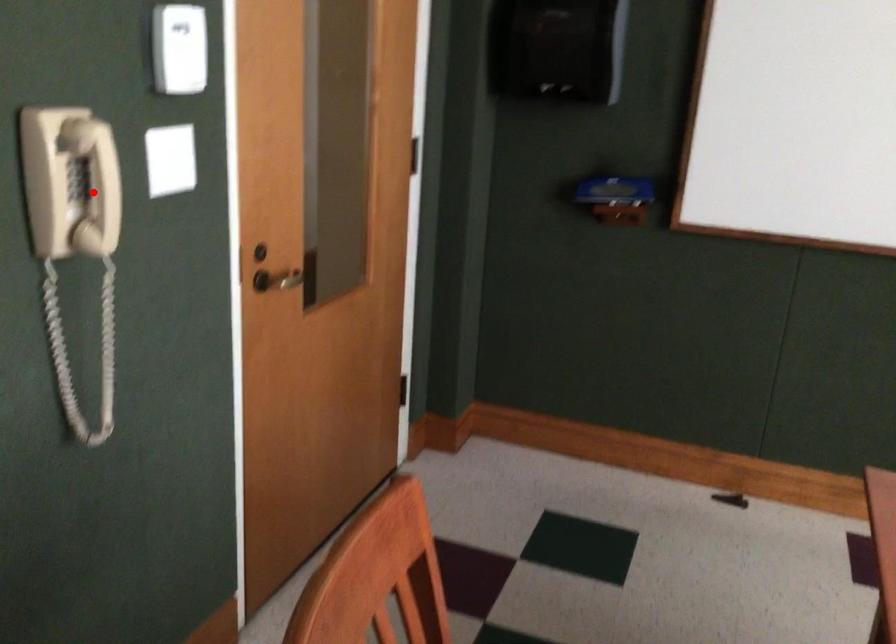
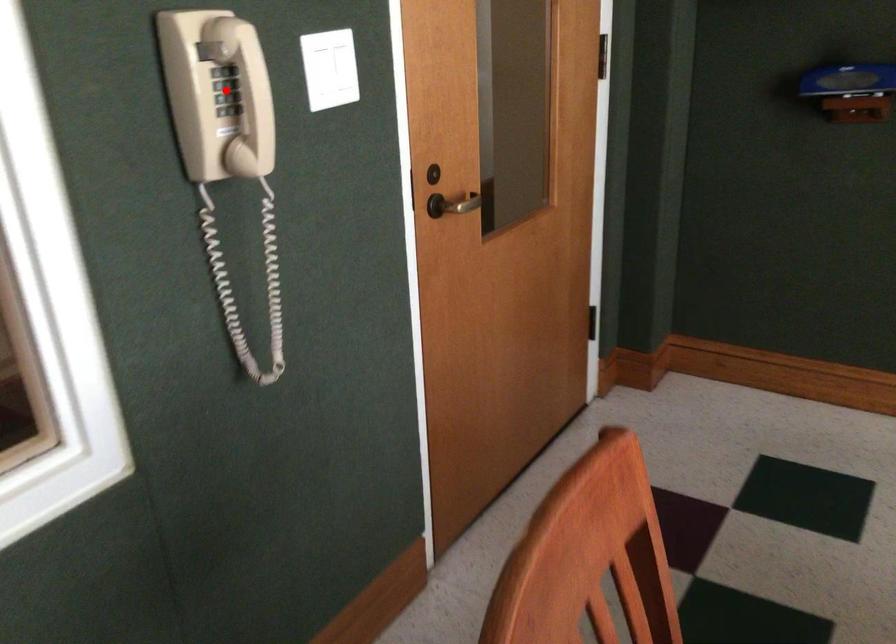
I am providing you with two images of the same scene from different viewpoints. A red point is marked on the first image and another point is marked on the second image. Are the points marked in image1 and image2 representing the same 3D position?

Yes